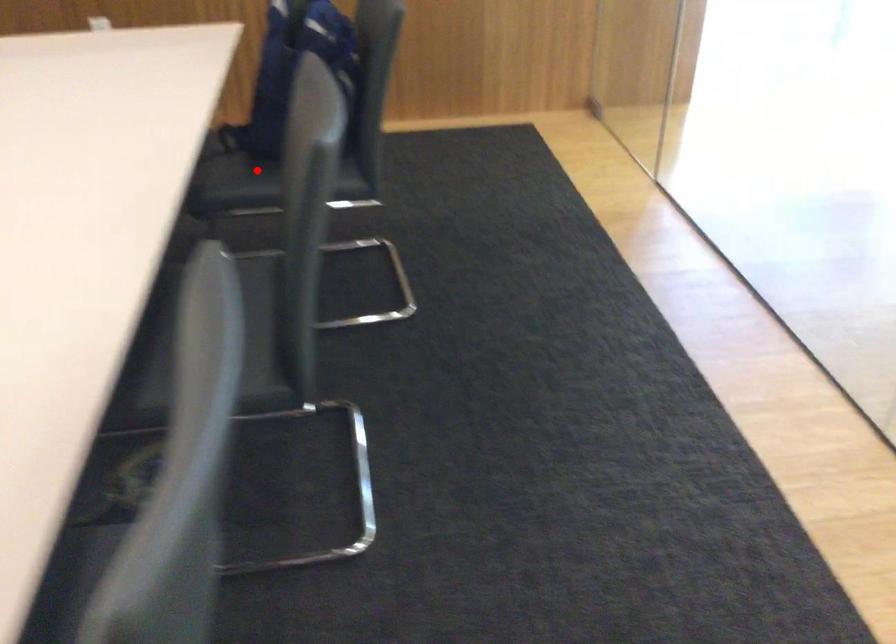
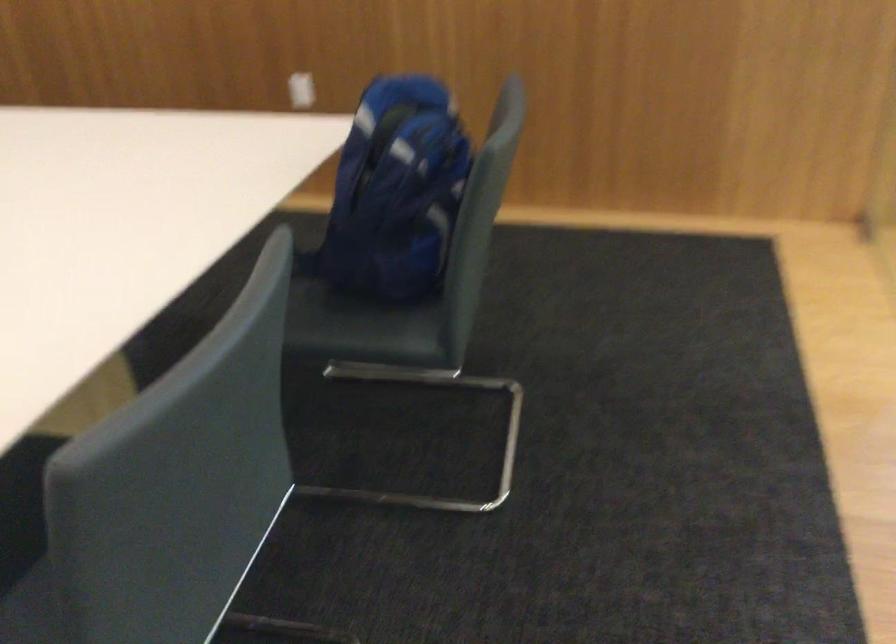
Find the pixel in the second image that matches the highlighted location in the first image.

(323, 308)